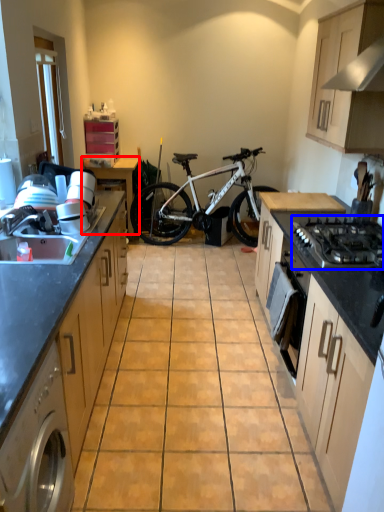
Question: Which point is further to the camera, table (highlighted by a red box) or gas stove (highlighted by a blue box)?

Choices:
 (A) table
 (B) gas stove

Answer: (A)